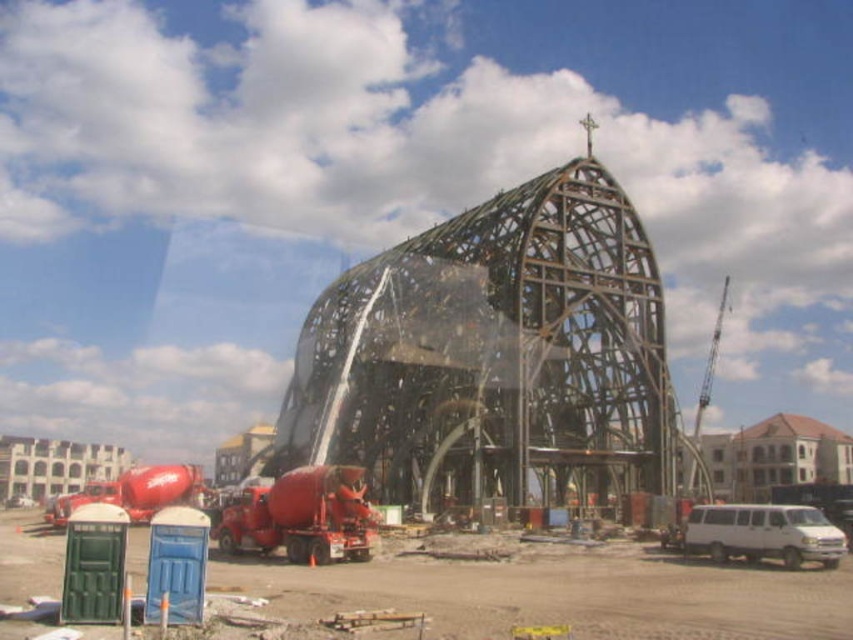
You are standing at the center of the construction site. Looking around, you see the point at coordinates point (496, 356). What is located at that point?

The point at coordinates point (496, 356) indicates the metallic framework at center.

You are standing at the construction site and want to know if the point at coordinates point (498, 403) is closer to you or the point at coordinates point (747, 522). Which point is closer to your current position?

Point (747, 522) is closer to you because the description states that point (498, 403) is behind point (747, 522), meaning it is farther away.